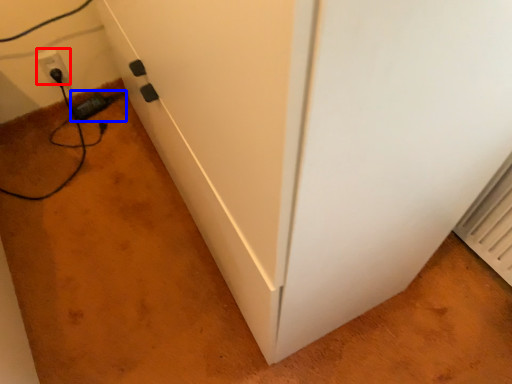
Question: Which point is further to the camera, electric outlet (highlighted by a red box) or plug (highlighted by a blue box)?

Choices:
 (A) electric outlet
 (B) plug

Answer: (B)